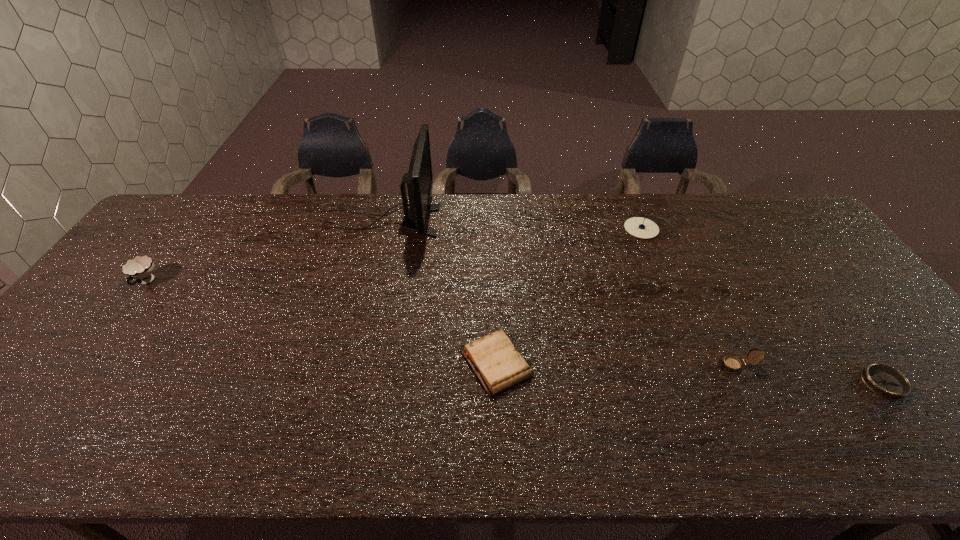
Identify the location of free space located 0.290m on the side of the cup with the handle. (70, 386).

Locate an element on the screen. The width and height of the screenshot is (960, 540). free space located 0.330m on the left of the farthest compass is located at coordinates (524, 228).

At what (x,y) coordinates should I click in order to perform the action: click on vacant space located on the front of the second shortest object. Please return your answer as a coordinate pair (x, y). The height and width of the screenshot is (540, 960). Looking at the image, I should click on (498, 449).

What are the coordinates of `free space located 0.400m on the left of the shortest compass` in the screenshot? It's located at (695, 383).

Identify the location of computer monitor located in the far edge section of the desktop. Image resolution: width=960 pixels, height=540 pixels. (419, 178).

Find the location of a particular element. The width and height of the screenshot is (960, 540). compass located in the far edge section of the desktop is located at coordinates (639, 227).

The height and width of the screenshot is (540, 960). I want to click on object present at the left edge, so click(140, 268).

This screenshot has height=540, width=960. What are the coordinates of `object located in the right edge section of the desktop` in the screenshot? It's located at (887, 382).

This screenshot has width=960, height=540. In order to click on vacant space at the far edge of the desktop in this screenshot , I will do `click(687, 193)`.

The width and height of the screenshot is (960, 540). I want to click on free space at the near edge of the desktop, so click(643, 451).